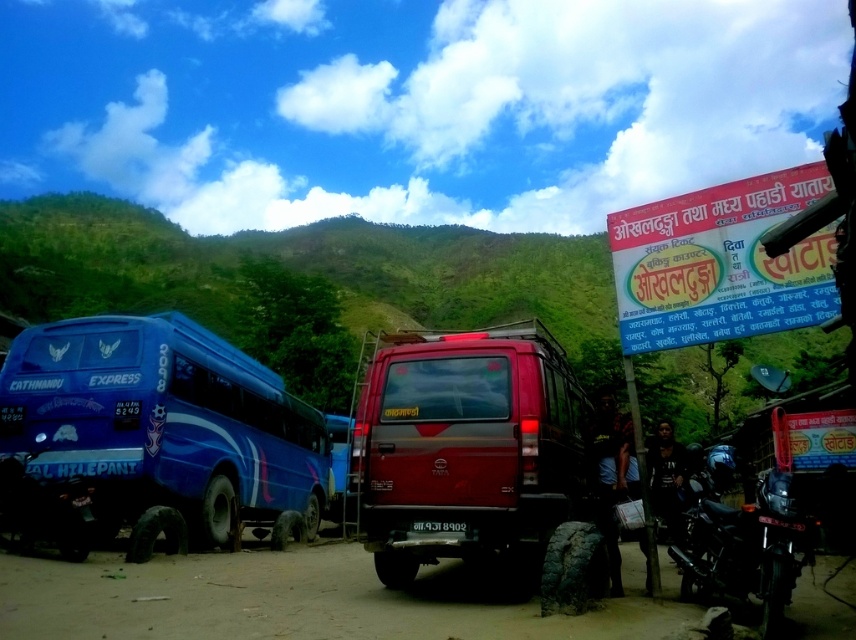
Question: Can you confirm if dirt field at lower center is positioned to the left of black matte motorcycle at lower right?

Choices:
 (A) yes
 (B) no

Answer: (A)

Question: Does blue glossy bus at left appear under dirt field at lower center?

Choices:
 (A) no
 (B) yes

Answer: (B)

Question: Which point is closer to the camera?

Choices:
 (A) black plastic license plate at center
 (B) shiny red van at center
 (C) dirt field at lower center
 (D) black matte motorcycle at lower right

Answer: (D)

Question: Considering the real-world distances, which object is closest to the black plastic license plate at center?

Choices:
 (A) dirt field at lower center
 (B) blue glossy bus at left

Answer: (A)

Question: Is black matte motorcycle at lower right positioned before black plastic license plate at center?

Choices:
 (A) no
 (B) yes

Answer: (B)

Question: Which object is closer to the camera taking this photo?

Choices:
 (A) black matte motorcycle at lower right
 (B) dirt field at lower center
 (C) shiny red van at center
 (D) black plastic license plate at center

Answer: (A)